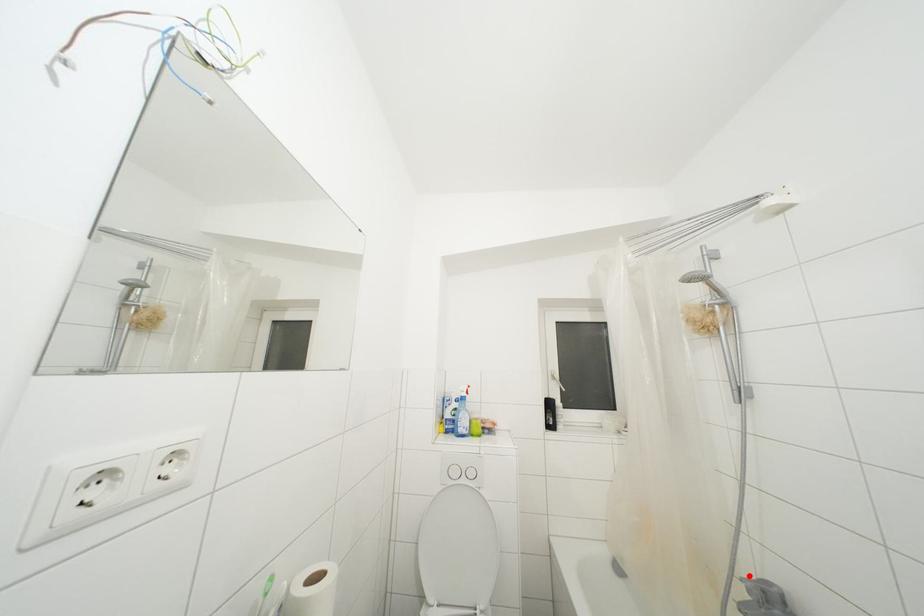
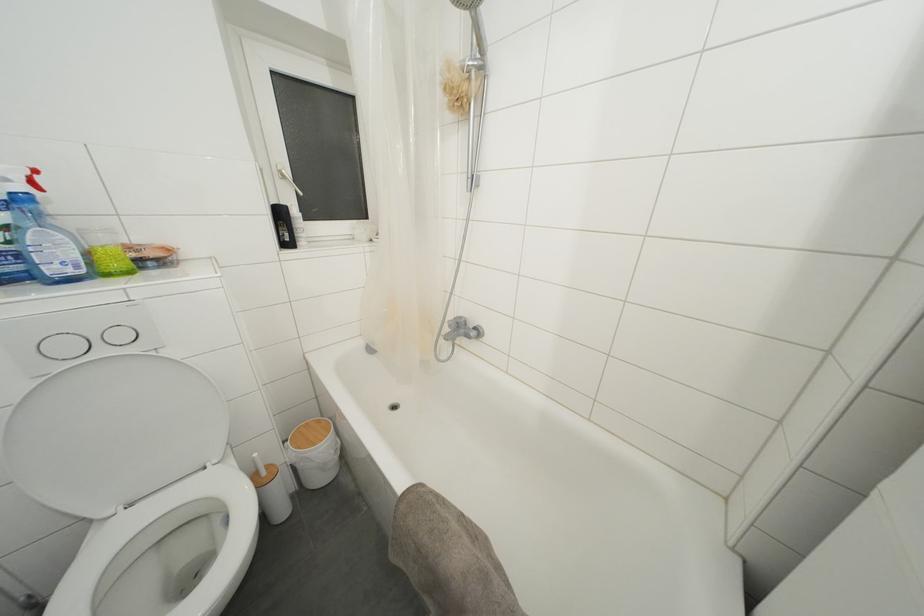
Where in the second image is the point corresponding to the highlighted location from the first image?

(455, 321)